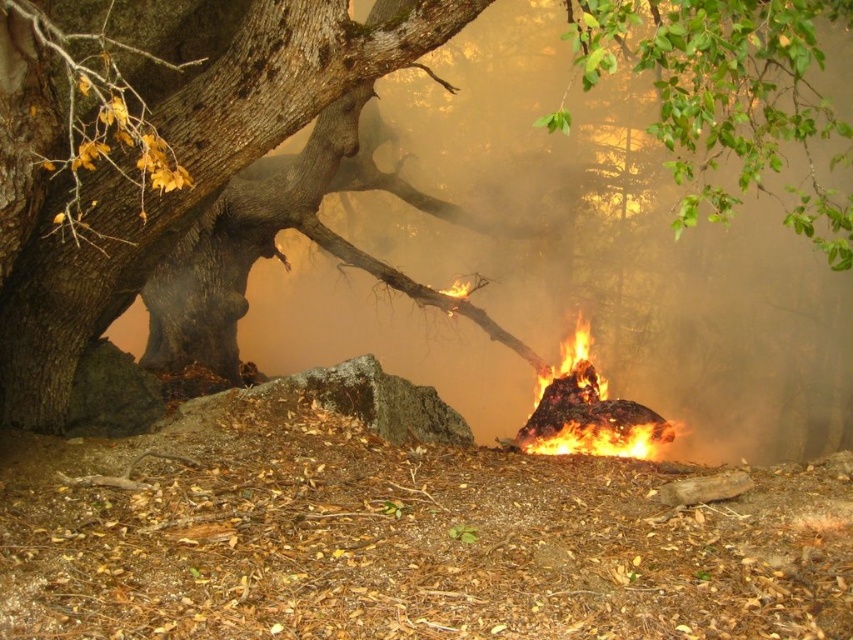
Question: Does rough bark tree at center have a larger size compared to flaming debris at center?

Choices:
 (A) yes
 (B) no

Answer: (A)

Question: Does rough bark tree at center have a lesser width compared to flaming debris at center?

Choices:
 (A) no
 (B) yes

Answer: (A)

Question: Which of the following is the closest to the observer?

Choices:
 (A) rough bark tree at center
 (B) flaming debris at center

Answer: (A)

Question: Which of the following is the closest to the observer?

Choices:
 (A) (566, 387)
 (B) (312, 97)

Answer: (B)

Question: Is rough bark tree at center to the left of flaming debris at center from the viewer's perspective?

Choices:
 (A) yes
 (B) no

Answer: (A)